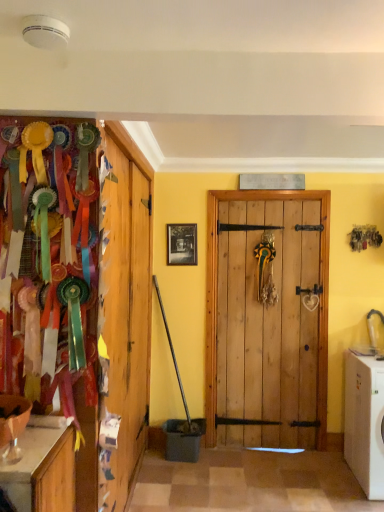
Question: Should I look upward or downward to see white plastic washing machine at lower right?

Choices:
 (A) up
 (B) down

Answer: (B)

Question: Is black matte picture frame at center with white plastic washing machine at lower right?

Choices:
 (A) no
 (B) yes

Answer: (A)

Question: Is the depth of black matte picture frame at center less than that of white plastic washing machine at lower right?

Choices:
 (A) no
 (B) yes

Answer: (A)

Question: Is black matte picture frame at center taller than white plastic washing machine at lower right?

Choices:
 (A) no
 (B) yes

Answer: (A)

Question: From a real-world perspective, does black matte picture frame at center stand above white plastic washing machine at lower right?

Choices:
 (A) no
 (B) yes

Answer: (B)

Question: Are black matte picture frame at center and white plastic washing machine at lower right located far from each other?

Choices:
 (A) no
 (B) yes

Answer: (B)

Question: Is black matte picture frame at center looking in the opposite direction of white plastic washing machine at lower right?

Choices:
 (A) no
 (B) yes

Answer: (A)

Question: Is white plastic washing machine at lower right shorter than black matte picture frame at center?

Choices:
 (A) no
 (B) yes

Answer: (A)

Question: Is white plastic washing machine at lower right positioned in front of black matte picture frame at center?

Choices:
 (A) no
 (B) yes

Answer: (B)

Question: Is the position of white plastic washing machine at lower right more distant than that of black matte picture frame at center?

Choices:
 (A) no
 (B) yes

Answer: (A)

Question: Can you confirm if white plastic washing machine at lower right is taller than black matte picture frame at center?

Choices:
 (A) yes
 (B) no

Answer: (A)

Question: Is white plastic washing machine at lower right touching black matte picture frame at center?

Choices:
 (A) no
 (B) yes

Answer: (A)

Question: From a real-world perspective, is white plastic washing machine at lower right on top of black matte picture frame at center?

Choices:
 (A) no
 (B) yes

Answer: (A)

Question: Is black matte picture frame at center taller or shorter than white plastic washing machine at lower right?

Choices:
 (A) tall
 (B) short

Answer: (B)